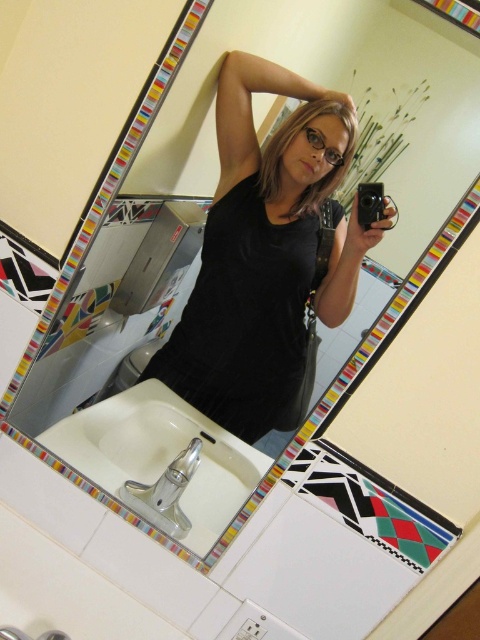
How far apart are black matte tank top at center and white ceramic sink at lower left?

black matte tank top at center is 10.47 inches away from white ceramic sink at lower left.

Is black matte tank top at center taller than white ceramic sink at lower left?

Yes.

Does point (325, 112) come behind point (214, 513)?

That is True.

I want to click on black matte tank top at center, so [x=256, y=250].